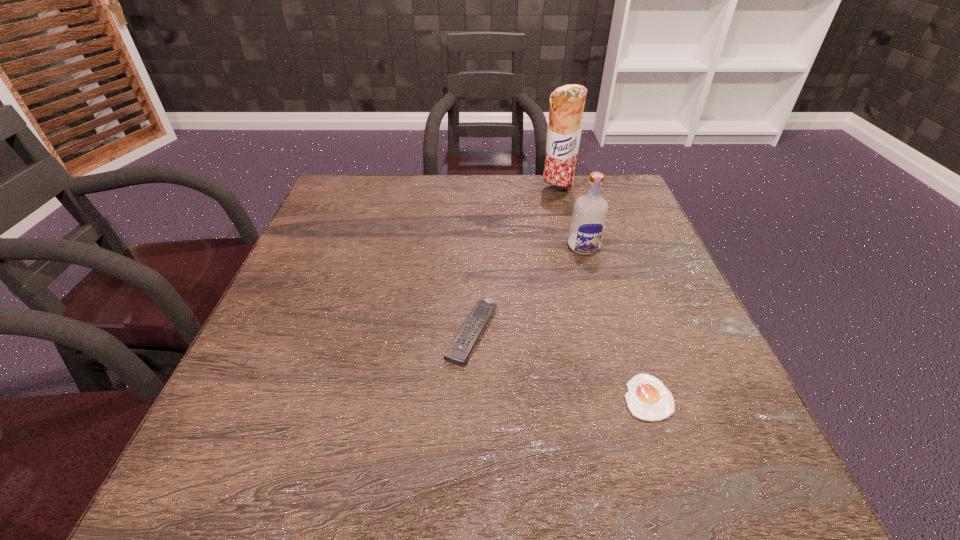
Identify the location of vacant space at the near left corner of the desktop. This screenshot has height=540, width=960. (262, 499).

Where is `vacant space at the far right corner of the desktop`? The image size is (960, 540). vacant space at the far right corner of the desktop is located at coordinates (608, 220).

Where is `free space between the second farthest object and the third tallest object`? This screenshot has width=960, height=540. free space between the second farthest object and the third tallest object is located at coordinates (528, 290).

Where is `free space between the second farthest object and the third farthest object`? free space between the second farthest object and the third farthest object is located at coordinates (528, 290).

Locate an element on the screen. vacant space that's between the farthest object and the second shortest object is located at coordinates (515, 262).

The height and width of the screenshot is (540, 960). I want to click on empty location between the nearest object and the second tallest object, so click(x=616, y=322).

Locate an element on the screen. free area in between the third farthest object and the farthest object is located at coordinates (515, 262).

This screenshot has height=540, width=960. I want to click on vacant space in between the burrito and the vodka, so click(570, 219).

The width and height of the screenshot is (960, 540). I want to click on empty location between the third tallest object and the burrito, so click(x=515, y=262).

Identify the location of vacant point located between the shortest object and the third farthest object. The height and width of the screenshot is (540, 960). (560, 365).